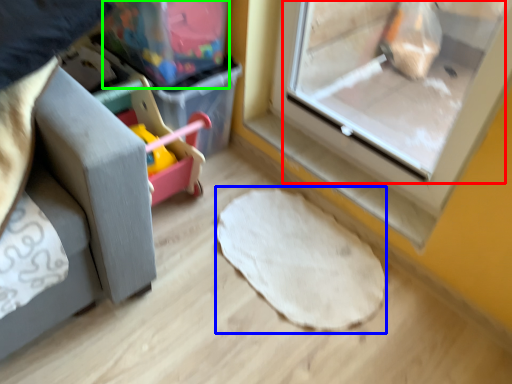
Question: Based on their relative distances, which object is nearer to screen door (highlighted by a red box)? Choose from mat (highlighted by a blue box) and storage box (highlighted by a green box).

Choices:
 (A) mat
 (B) storage box

Answer: (A)